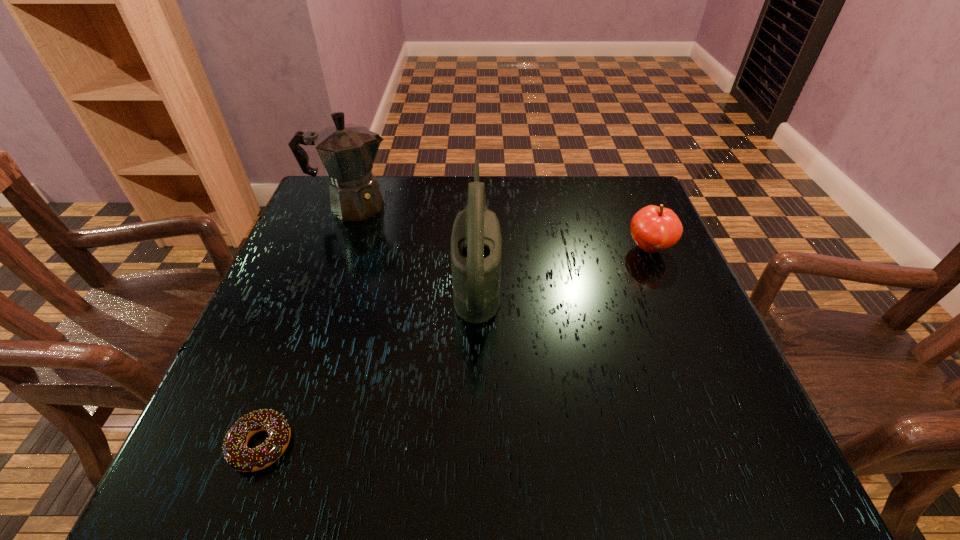
In order to click on vacant space at the right edge in this screenshot , I will do `click(623, 292)`.

You are a GUI agent. You are given a task and a screenshot of the screen. Output one action in this format:
    pyautogui.click(x=<x>, y=<y>)
    Task: Click on the vacant space at the near left corner
    The image size is (960, 540).
    Given the screenshot: What is the action you would take?
    click(x=204, y=430)

The width and height of the screenshot is (960, 540). I want to click on vacant space at the far right corner of the desktop, so click(x=622, y=225).

The image size is (960, 540). Find the location of `blank space at the near right corner of the desktop`. blank space at the near right corner of the desktop is located at coordinates (742, 440).

The height and width of the screenshot is (540, 960). I want to click on free space between the doughnut and the third object from left to right, so click(369, 361).

You are a GUI agent. You are given a task and a screenshot of the screen. Output one action in this format:
    pyautogui.click(x=<x>, y=<y>)
    Task: Click on the vacant space that is in between the second object from right to left and the rightmost object
    This screenshot has height=540, width=960.
    Given the screenshot: What is the action you would take?
    pyautogui.click(x=563, y=262)

This screenshot has width=960, height=540. What are the coordinates of `unoccupied area between the third tallest object and the watering can` in the screenshot? It's located at (563, 262).

Locate an element on the screen. Image resolution: width=960 pixels, height=540 pixels. vacant area between the third tallest object and the coffeepot is located at coordinates (500, 227).

This screenshot has width=960, height=540. In order to click on free space between the rightmost object and the shortest object in this screenshot , I will do `click(455, 347)`.

Identify the location of empty location between the third object from left to right and the coffeepot. Image resolution: width=960 pixels, height=540 pixels. 415,241.